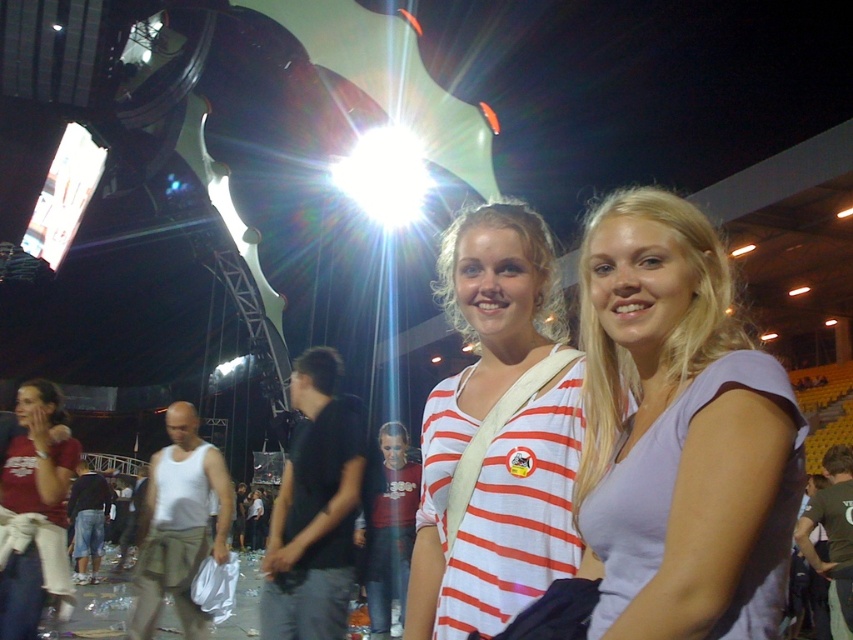
Question: Is purple matte shirt at center to the right of matte red shirt at lower left from the viewer's perspective?

Choices:
 (A) yes
 (B) no

Answer: (A)

Question: Which of the following is the farthest from the observer?

Choices:
 (A) white striped shirt at center
 (B) black cotton shirt at center
 (C) purple matte shirt at center

Answer: (B)

Question: Is purple matte shirt at center wider than matte red shirt at lower left?

Choices:
 (A) no
 (B) yes

Answer: (B)

Question: Which point is closer to the camera taking this photo?

Choices:
 (A) tap(286, 464)
 (B) tap(527, 520)
 (C) tap(691, 358)
 (D) tap(194, 627)

Answer: (C)

Question: Which point is farther from the camera taking this photo?

Choices:
 (A) (677, 298)
 (B) (173, 435)

Answer: (B)

Question: Is purple matte shirt at center in front of white striped shirt at center?

Choices:
 (A) yes
 (B) no

Answer: (A)